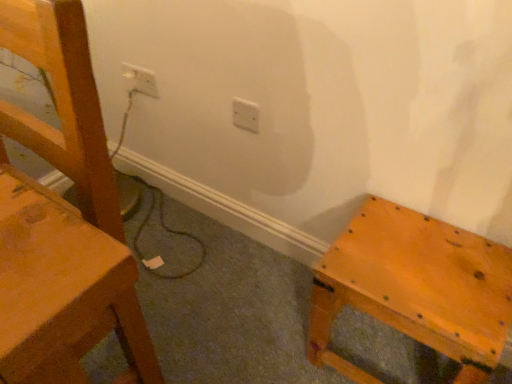
At what (x,y) coordinates should I click in order to perform the action: click on free space above matte wooden stool at lower right (from a real-world perspective). Please return your answer as a coordinate pair (x, y). The height and width of the screenshot is (384, 512). Looking at the image, I should click on (420, 248).